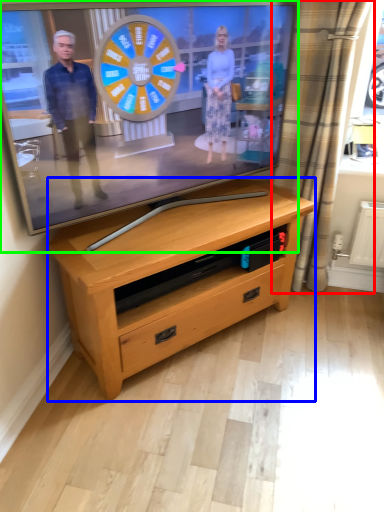
Question: Which object is positioned farthest from curtain (highlighted by a red box)? Select from chest of drawers (highlighted by a blue box) and television (highlighted by a green box).

Choices:
 (A) chest of drawers
 (B) television

Answer: (A)